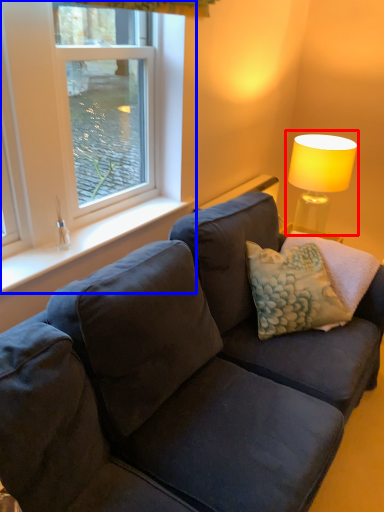
Question: Which object is further to the camera taking this photo, table lamp (highlighted by a red box) or window (highlighted by a blue box)?

Choices:
 (A) table lamp
 (B) window

Answer: (A)